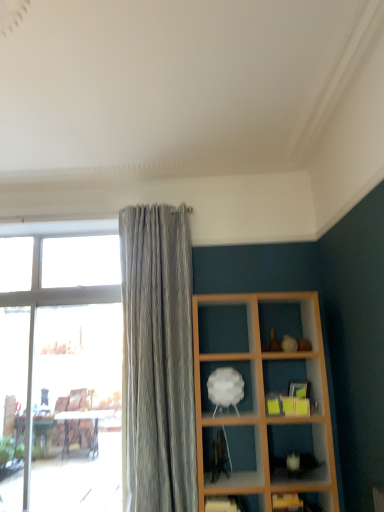
In order to face matte white shelf at lower center, which ranks as the 2th shelf in top-to-bottom order, should I rotate leftwards or rightwards?

You should rotate right by 5.776 degrees.

Locate an element on the screen. The width and height of the screenshot is (384, 512). matte white shelf at lower center, the second shelf positioned from the bottom is located at coordinates (234, 503).

You are a GUI agent. You are given a task and a screenshot of the screen. Output one action in this format:
    pyautogui.click(x=<x>, y=<y>)
    Task: Click on the wooden shelf at lower right, the third shelf from the top
    This screenshot has width=384, height=512.
    Given the screenshot: What is the action you would take?
    pyautogui.click(x=300, y=502)

In the scene shown: Looking at their sizes, would you say wooden shelf at lower right, the third shelf from the top, is wider or thinner than matte white shelf at lower center, the second shelf positioned from the bottom?

Considering their sizes, wooden shelf at lower right, the third shelf from the top, looks broader than matte white shelf at lower center, the second shelf positioned from the bottom.

Is wooden shelf at lower right, the first shelf ordered from the bottom, to the right of matte white shelf at lower center, the second shelf positioned from the bottom, from the viewer's perspective?

Yes, wooden shelf at lower right, the first shelf ordered from the bottom, is to the right of matte white shelf at lower center, the second shelf positioned from the bottom.

Between wooden shelf at lower right, the third shelf from the top, and matte white shelf at lower center, the second shelf positioned from the bottom, which one has larger size?

wooden shelf at lower right, the third shelf from the top, is bigger.

From the picture: Is matte white shelf at lower center, the second shelf positioned from the bottom, at the back of wooden shelf at lower right, the first shelf ordered from the bottom?

No, wooden shelf at lower right, the first shelf ordered from the bottom, is not facing away from matte white shelf at lower center, the second shelf positioned from the bottom.

Is point (242, 498) farther from viewer compared to point (307, 501)?

Yes.

Which object is more forward, matte white shelf at lower center, which ranks as the 2th shelf in top-to-bottom order, or wooden shelf at lower right, the first shelf ordered from the bottom?

Positioned in front is wooden shelf at lower right, the first shelf ordered from the bottom.

Can wooden shelf at lower right, the third shelf from the top, be found inside matte white shelf at lower center, which ranks as the 2th shelf in top-to-bottom order?

No, wooden shelf at lower right, the third shelf from the top, is located outside of matte white shelf at lower center, which ranks as the 2th shelf in top-to-bottom order.

Relative to white matte cloud at center, which is counted as the 1th shelf, starting from the top, is transparent glass window at left in front or behind?

transparent glass window at left is positioned farther from the viewer than white matte cloud at center, which is counted as the 1th shelf, starting from the top.

Which of these two, transparent glass window at left or white matte cloud at center, which is counted as the 1th shelf, starting from the top, stands shorter?

white matte cloud at center, which is counted as the 1th shelf, starting from the top.

Who is smaller, transparent glass window at left or white matte cloud at center, acting as the third shelf starting from the bottom?

white matte cloud at center, acting as the third shelf starting from the bottom, is smaller.

Are transparent glass window at left and wooden shelf at lower right, the third shelf from the top, beside each other?

No, transparent glass window at left is not beside wooden shelf at lower right, the third shelf from the top.

Find the location of a particular element. This screenshot has height=512, width=384. window behind the wooden shelf at lower right, the third shelf from the top is located at coordinates (62, 364).

From a real-world perspective, between transparent glass window at left and wooden shelf at lower right, the first shelf ordered from the bottom, who is vertically higher?

transparent glass window at left is physically above.

From the image's perspective, between transparent glass window at left and wooden shelf at lower right, the first shelf ordered from the bottom, who is located below?

wooden shelf at lower right, the first shelf ordered from the bottom.

From the image's perspective, does matte white shelf at lower center, which ranks as the 2th shelf in top-to-bottom order, appear lower than transparent glass window at left?

Yes, from the image's perspective, matte white shelf at lower center, which ranks as the 2th shelf in top-to-bottom order, is below transparent glass window at left.

From a real-world perspective, who is located higher, matte white shelf at lower center, the second shelf positioned from the bottom, or transparent glass window at left?

transparent glass window at left is physically above.

At what (x,y) coordinates should I click in order to perform the action: click on the 1st shelf positioned below the transparent glass window at left (from a real-world perspective). Please return your answer as a coordinate pair (x, y). The image size is (384, 512). Looking at the image, I should click on (234, 503).

Which is nearer, (252,500) or (111,411)?

Positioned in front is point (252,500).

Could you tell me if wooden shelf at lower right, the first shelf ordered from the bottom, is facing white matte cloud at center, acting as the third shelf starting from the bottom?

No, wooden shelf at lower right, the first shelf ordered from the bottom, does not turn towards white matte cloud at center, acting as the third shelf starting from the bottom.

Is wooden shelf at lower right, the third shelf from the top, far away from white matte cloud at center, which is counted as the 1th shelf, starting from the top?

wooden shelf at lower right, the third shelf from the top, is near white matte cloud at center, which is counted as the 1th shelf, starting from the top, not far away.

From a real-world perspective, which object rests below the other?

wooden shelf at lower right, the third shelf from the top, from a real-world perspective.

Between point (320, 503) and point (204, 386), which one is positioned in front?

Positioned in front is point (320, 503).

Is white matte cloud at center, which is counted as the 1th shelf, starting from the top, smaller than transparent glass window at left?

Indeed, white matte cloud at center, which is counted as the 1th shelf, starting from the top, has a smaller size compared to transparent glass window at left.

Are white matte cloud at center, acting as the third shelf starting from the bottom, and transparent glass window at left located far from each other?

Indeed, white matte cloud at center, acting as the third shelf starting from the bottom, is not near transparent glass window at left.

Does white matte cloud at center, acting as the third shelf starting from the bottom, have a greater width compared to transparent glass window at left?

Yes, white matte cloud at center, acting as the third shelf starting from the bottom, is wider than transparent glass window at left.

Is white matte cloud at center, acting as the third shelf starting from the bottom, facing towards transparent glass window at left?

No, white matte cloud at center, acting as the third shelf starting from the bottom, is not turned towards transparent glass window at left.

Which shelf is the 1st one when counting from the back of the wooden shelf at lower right, the first shelf ordered from the bottom? Please provide its 2D coordinates.

[(234, 503)]

The image size is (384, 512). I want to click on the 1st shelf above the wooden shelf at lower right, the third shelf from the top (from a real-world perspective), so click(x=234, y=503).

Which object lies nearer to the anchor point white matte cloud at center, which is counted as the 1th shelf, starting from the top, matte white shelf at lower center, which ranks as the 2th shelf in top-to-bottom order, or transparent glass window at left?

matte white shelf at lower center, which ranks as the 2th shelf in top-to-bottom order, is closer to white matte cloud at center, which is counted as the 1th shelf, starting from the top.

When comparing their distances from white matte cloud at center, acting as the third shelf starting from the bottom, does matte white shelf at lower center, which ranks as the 2th shelf in top-to-bottom order, or wooden shelf at lower right, the third shelf from the top, seem closer?

matte white shelf at lower center, which ranks as the 2th shelf in top-to-bottom order.

Estimate the real-world distances between objects in this image. Which object is further from matte white shelf at lower center, which ranks as the 2th shelf in top-to-bottom order, transparent glass window at left or white matte cloud at center, acting as the third shelf starting from the bottom?

Among the two, transparent glass window at left is located further to matte white shelf at lower center, which ranks as the 2th shelf in top-to-bottom order.

Estimate the real-world distances between objects in this image. Which object is closer to wooden shelf at lower right, the first shelf ordered from the bottom, white matte cloud at center, which is counted as the 1th shelf, starting from the top, or matte white shelf at lower center, which ranks as the 2th shelf in top-to-bottom order?

matte white shelf at lower center, which ranks as the 2th shelf in top-to-bottom order, lies closer to wooden shelf at lower right, the first shelf ordered from the bottom, than the other object.

From the image, which object appears to be nearer to white matte cloud at center, acting as the third shelf starting from the bottom, wooden shelf at lower right, the third shelf from the top, or matte white shelf at lower center, which ranks as the 2th shelf in top-to-bottom order?

matte white shelf at lower center, which ranks as the 2th shelf in top-to-bottom order, is closer to white matte cloud at center, acting as the third shelf starting from the bottom.

Looking at the image, which one is located closer to transparent glass window at left, wooden shelf at lower right, the third shelf from the top, or white matte cloud at center, which is counted as the 1th shelf, starting from the top?

The object closer to transparent glass window at left is white matte cloud at center, which is counted as the 1th shelf, starting from the top.

From the image, which object appears to be farther from transparent glass window at left, wooden shelf at lower right, the first shelf ordered from the bottom, or matte white shelf at lower center, which ranks as the 2th shelf in top-to-bottom order?

wooden shelf at lower right, the first shelf ordered from the bottom.

Looking at the image, which one is located further to wooden shelf at lower right, the third shelf from the top, transparent glass window at left or matte white shelf at lower center, the second shelf positioned from the bottom?

Based on the image, transparent glass window at left appears to be further to wooden shelf at lower right, the third shelf from the top.

This screenshot has height=512, width=384. I want to click on shelf between transparent glass window at left and matte white shelf at lower center, which ranks as the 2th shelf in top-to-bottom order, from left to right, so click(x=238, y=371).

Image resolution: width=384 pixels, height=512 pixels. What are the coordinates of `shelf between white matte cloud at center, which is counted as the 1th shelf, starting from the top, and wooden shelf at lower right, the first shelf ordered from the bottom, in the vertical direction` in the screenshot? It's located at (234, 503).